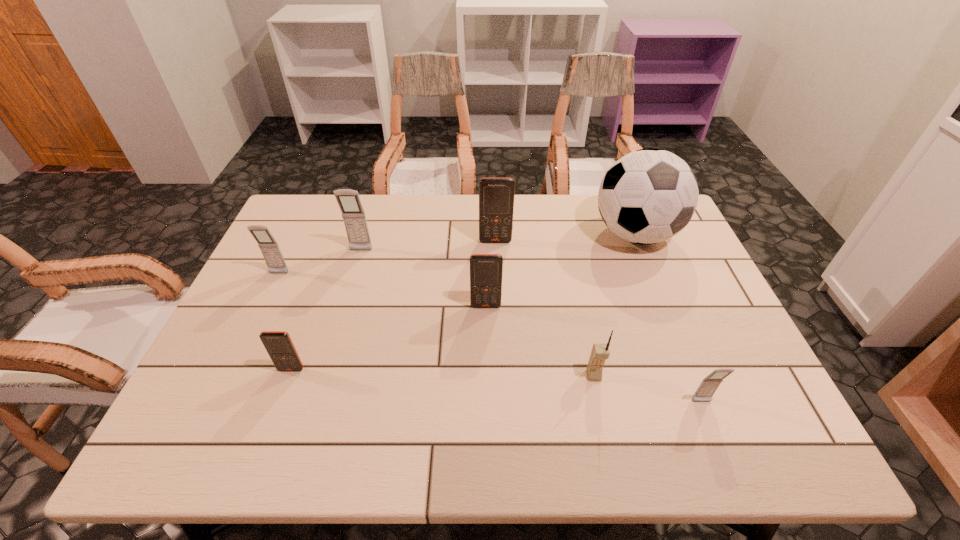
The width and height of the screenshot is (960, 540). What are the coordinates of `the second cellular telephone from right to left` in the screenshot? It's located at (600, 352).

Image resolution: width=960 pixels, height=540 pixels. Find the location of `the seventh object from right to left`. the seventh object from right to left is located at coordinates (278, 344).

Image resolution: width=960 pixels, height=540 pixels. Identify the location of the nearest orange cellular telephone. (278, 344).

Where is `the rightmost cellular telephone`? the rightmost cellular telephone is located at coordinates (708, 386).

At what (x,y) coordinates should I click in order to perform the action: click on the nearest cellular telephone. Please return your answer as a coordinate pair (x, y). Image resolution: width=960 pixels, height=540 pixels. Looking at the image, I should click on (708, 386).

Locate an element on the screen. vacant point located 0.120m on the main logo of the black soccer ball is located at coordinates coord(660,293).

Locate an element on the screen. free region located on the front-facing side of the sixth object from right to left is located at coordinates (337, 332).

The image size is (960, 540). I want to click on free spot located 0.340m on the screen of the biggest orange cellular telephone, so (499, 330).

Locate an element on the screen. The height and width of the screenshot is (540, 960). vacant position located 0.130m on the front-facing side of the second nearest gray cellular telephone is located at coordinates (261, 310).

Locate an element on the screen. free space located on the screen of the fifth farthest object is located at coordinates (487, 373).